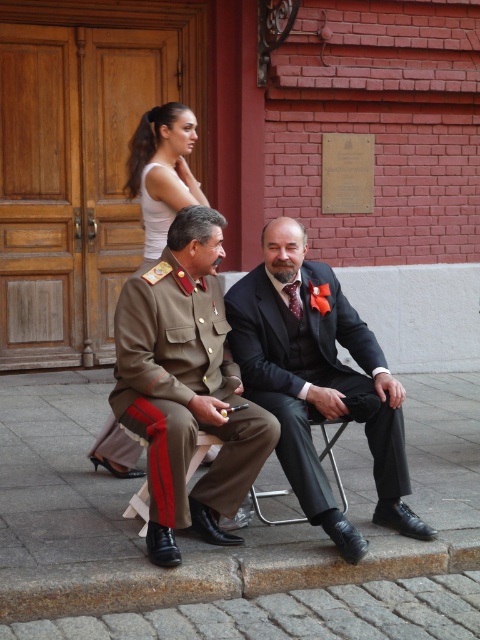
Question: Is matte black suit at center above white tank top at upper center?

Choices:
 (A) yes
 (B) no

Answer: (B)

Question: Can you confirm if matte brown uniform at center is positioned to the left of white tank top at upper center?

Choices:
 (A) no
 (B) yes

Answer: (A)

Question: Estimate the real-world distances between objects in this image. Which object is farther from the matte brown uniform at center?

Choices:
 (A) khaki uniform at center
 (B) white tank top at upper center
 (C) white fabric dress at upper center
 (D) matte black suit at center

Answer: (C)

Question: In this image, where is matte brown uniform at center located relative to white tank top at upper center?

Choices:
 (A) left
 (B) right

Answer: (B)

Question: Among these objects, which one is farthest from the camera?

Choices:
 (A) matte black suit at center
 (B) khaki uniform at center
 (C) white fabric dress at upper center

Answer: (C)

Question: Among these points, which one is farthest from the camera?

Choices:
 (A) (179, 168)
 (B) (204, 321)

Answer: (A)